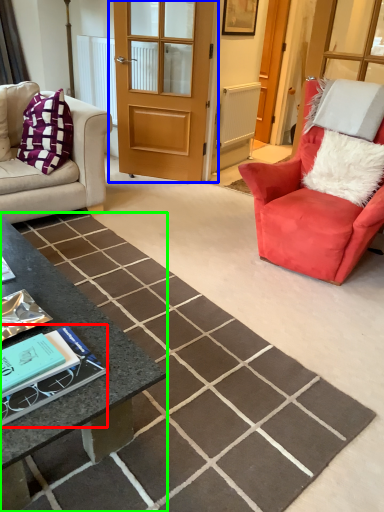
Question: Estimate the real-world distances between objects in this image. Which object is farther from book (highlighted by a red box), door (highlighted by a blue box) or coffee table (highlighted by a green box)?

Choices:
 (A) door
 (B) coffee table

Answer: (A)